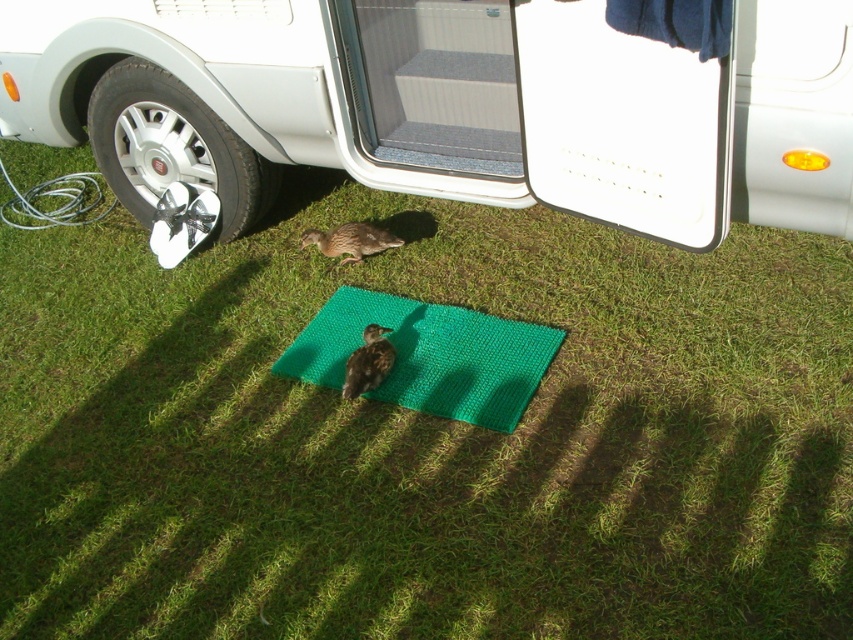
Question: Does clear plastic screen door at upper center lie in front of brown feathered duck at center?

Choices:
 (A) no
 (B) yes

Answer: (B)

Question: Which object is closer to the camera taking this photo?

Choices:
 (A) green knitted yoga mat at center
 (B) white matte recreational vehicle at lower left

Answer: (B)

Question: Is white matte recreational vehicle at lower left closer to camera compared to brown fuzzy bird at center?

Choices:
 (A) no
 (B) yes

Answer: (B)

Question: Which object appears closest to the camera in this image?

Choices:
 (A) brown fuzzy bird at center
 (B) white matte recreational vehicle at lower left
 (C) green knitted yoga mat at center

Answer: (B)

Question: Which point is closer to the camera?

Choices:
 (A) clear plastic screen door at upper center
 (B) brown feathered duck at center
 (C) white matte recreational vehicle at lower left
 (D) green knitted yoga mat at center

Answer: (C)

Question: Does green knitted yoga mat at center have a greater width compared to brown fuzzy bird at center?

Choices:
 (A) yes
 (B) no

Answer: (A)